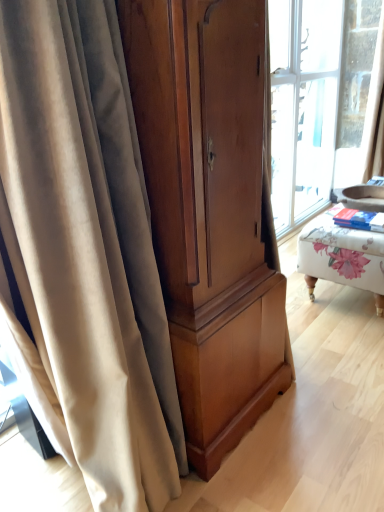
Question: Is matte wood cabinet at center shorter than floral fabric ottoman at right?

Choices:
 (A) yes
 (B) no

Answer: (B)

Question: Is matte wood cabinet at center facing towards floral fabric ottoman at right?

Choices:
 (A) yes
 (B) no

Answer: (B)

Question: Is the depth of matte wood cabinet at center less than that of floral fabric ottoman at right?

Choices:
 (A) no
 (B) yes

Answer: (B)

Question: Is matte wood cabinet at center surrounding floral fabric ottoman at right?

Choices:
 (A) yes
 (B) no

Answer: (B)

Question: Is matte wood cabinet at center thinner than floral fabric ottoman at right?

Choices:
 (A) no
 (B) yes

Answer: (B)

Question: From a real-world perspective, relative to floral fabric ottoman at right, is matte wood cabinet at center vertically above or below?

Choices:
 (A) above
 (B) below

Answer: (A)

Question: Would you say matte wood cabinet at center is to the left or to the right of floral fabric ottoman at right in the picture?

Choices:
 (A) left
 (B) right

Answer: (A)

Question: In terms of width, does matte wood cabinet at center look wider or thinner when compared to floral fabric ottoman at right?

Choices:
 (A) thin
 (B) wide

Answer: (A)

Question: From the image's perspective, is matte wood cabinet at center positioned above or below floral fabric ottoman at right?

Choices:
 (A) above
 (B) below

Answer: (B)

Question: Is point (233, 376) closer or farther from the camera than point (89, 359)?

Choices:
 (A) closer
 (B) farther

Answer: (B)

Question: Relative to beige velvet curtain at left, is matte wood cabinet at center in front or behind?

Choices:
 (A) front
 (B) behind

Answer: (B)

Question: Is matte wood cabinet at center situated inside beige velvet curtain at left or outside?

Choices:
 (A) inside
 (B) outside

Answer: (B)

Question: Based on their positions, is matte wood cabinet at center located to the left or right of beige velvet curtain at left?

Choices:
 (A) left
 (B) right

Answer: (B)

Question: Is beige velvet curtain at left in front of or behind matte wood cabinet at center in the image?

Choices:
 (A) front
 (B) behind

Answer: (A)

Question: Does point (28, 44) appear closer or farther from the camera than point (160, 196)?

Choices:
 (A) farther
 (B) closer

Answer: (B)